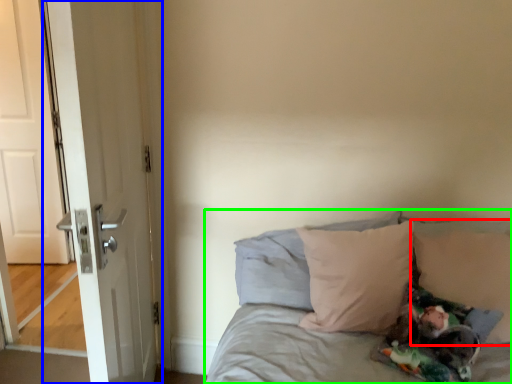
Question: Based on their relative distances, which object is nearer to pillow (highlighted by a red box)? Choose from door (highlighted by a blue box) and bed (highlighted by a green box).

Choices:
 (A) door
 (B) bed

Answer: (B)